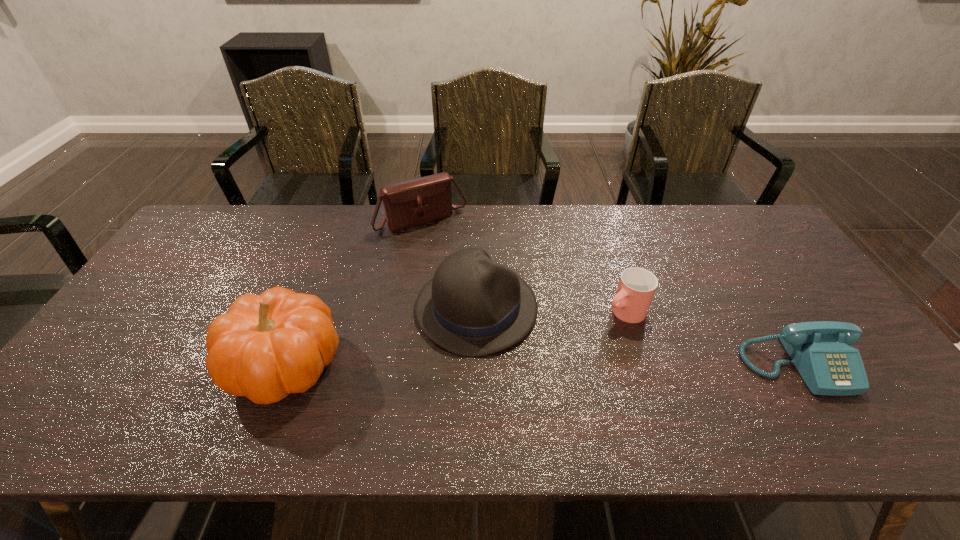
Locate an element on the screen. The image size is (960, 540). blank area located on the front-facing side of the bowler hat is located at coordinates click(x=674, y=399).

Locate an element on the screen. free space located on the front-facing side of the bowler hat is located at coordinates (619, 374).

You are a GUI agent. You are given a task and a screenshot of the screen. Output one action in this format:
    pyautogui.click(x=<x>, y=<y>)
    Task: Click on the vacant space situated 0.300m on the front-facing side of the bowler hat
    The width and height of the screenshot is (960, 540).
    Given the screenshot: What is the action you would take?
    pyautogui.click(x=644, y=385)

Locate an element on the screen. free space located 0.110m on the front flap of the farthest object is located at coordinates (454, 254).

What are the coordinates of `free point located 0.060m on the front flap of the farthest object` in the screenshot? It's located at (447, 245).

At what (x,y) coordinates should I click in order to perform the action: click on free space located 0.310m on the front flap of the farthest object. Please return your answer as a coordinate pair (x, y). This screenshot has height=540, width=960. Looking at the image, I should click on (484, 294).

Identify the location of object that is at the far edge. The width and height of the screenshot is (960, 540). (417, 201).

You are a GUI agent. You are given a task and a screenshot of the screen. Output one action in this format:
    pyautogui.click(x=<x>, y=<y>)
    Task: Click on the pumpkin that is at the near edge
    Image resolution: width=960 pixels, height=540 pixels.
    Given the screenshot: What is the action you would take?
    pyautogui.click(x=266, y=346)

This screenshot has height=540, width=960. What are the coordinates of `telephone that is at the near edge` in the screenshot? It's located at (820, 350).

Where is `object that is at the right edge`? object that is at the right edge is located at coordinates (820, 350).